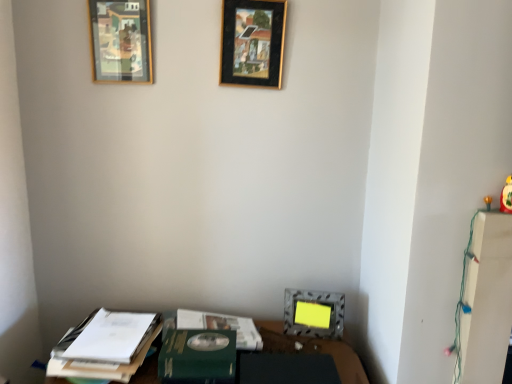
Question: Is green matte paperback book at lower center turned away from metallic silver picture frame at lower center, acting as the first picture frame starting from the bottom?

Choices:
 (A) yes
 (B) no

Answer: (B)

Question: From a real-world perspective, is green matte paperback book at lower center under metallic silver picture frame at lower center, the 3th picture frame from the top?

Choices:
 (A) yes
 (B) no

Answer: (A)

Question: Is green matte paperback book at lower center in contact with metallic silver picture frame at lower center, acting as the 1th picture frame starting from the right?

Choices:
 (A) yes
 (B) no

Answer: (B)

Question: Does green matte paperback book at lower center have a greater width compared to metallic silver picture frame at lower center, acting as the 1th picture frame starting from the right?

Choices:
 (A) no
 (B) yes

Answer: (B)

Question: Is green matte paperback book at lower center far away from metallic silver picture frame at lower center, positioned as the 3th picture frame in left-to-right order?

Choices:
 (A) no
 (B) yes

Answer: (A)

Question: From a real-world perspective, is wooden frame at upper left, the first picture frame viewed from the top, physically located above or below black matte picture frame at upper center, the second picture frame in the bottom-to-top sequence?

Choices:
 (A) above
 (B) below

Answer: (B)

Question: Is wooden frame at upper left, which is the third picture frame from right to left, taller or shorter than black matte picture frame at upper center, the 2th picture frame in the left-to-right sequence?

Choices:
 (A) tall
 (B) short

Answer: (B)

Question: Is point (140, 64) positioned closer to the camera than point (271, 61)?

Choices:
 (A) closer
 (B) farther

Answer: (B)

Question: Is wooden frame at upper left, which is the first picture frame in left-to-right order, inside the boundaries of black matte picture frame at upper center, arranged as the second picture frame when viewed from the right, or outside?

Choices:
 (A) outside
 (B) inside

Answer: (A)

Question: Is green matte journal at lower center taller or shorter than yellow matte toy at right?

Choices:
 (A) short
 (B) tall

Answer: (A)

Question: Considering their positions, is green matte journal at lower center located in front of or behind yellow matte toy at right?

Choices:
 (A) behind
 (B) front

Answer: (A)

Question: From a real-world perspective, is green matte journal at lower center positioned above or below yellow matte toy at right?

Choices:
 (A) above
 (B) below

Answer: (B)

Question: In terms of width, does green matte journal at lower center look wider or thinner when compared to yellow matte toy at right?

Choices:
 (A) wide
 (B) thin

Answer: (A)

Question: From the image's perspective, is yellow matte toy at right located above or below wooden frame at upper left, the first picture frame viewed from the top?

Choices:
 (A) below
 (B) above

Answer: (A)

Question: From their relative heights in the image, would you say yellow matte toy at right is taller or shorter than wooden frame at upper left, the 3th picture frame in the bottom-to-top sequence?

Choices:
 (A) tall
 (B) short

Answer: (B)